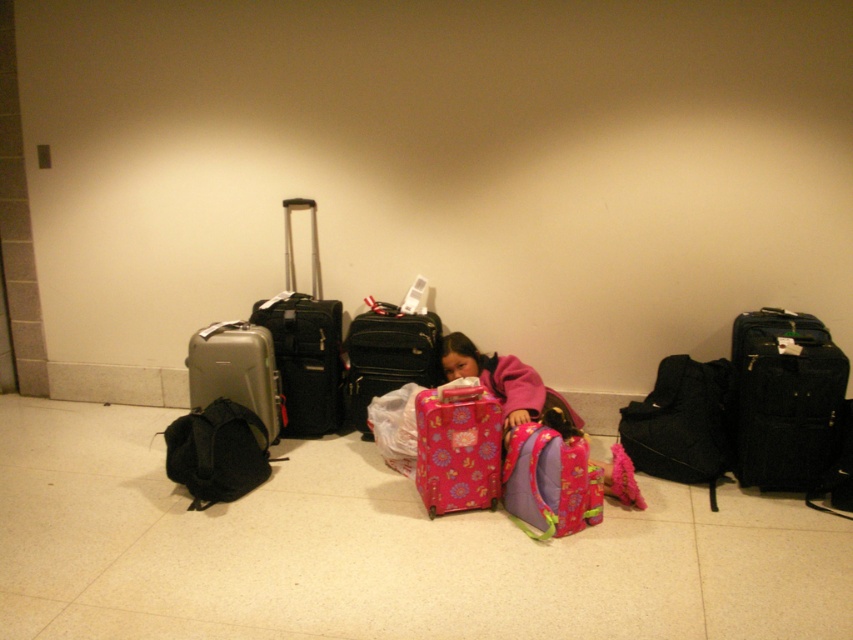
Question: Estimate the real-world distances between objects in this image. Which object is closer to the silver metallic suitcase at left?

Choices:
 (A) black fabric suitcase at right
 (B) black fabric backpack at left

Answer: (B)

Question: Can you confirm if black fabric suitcase at right is wider than pink floral suitcase at center?

Choices:
 (A) yes
 (B) no

Answer: (B)

Question: Among these points, which one is farthest from the camera?

Choices:
 (A) (386, 376)
 (B) (508, 460)
 (C) (323, 429)

Answer: (C)

Question: Estimate the real-world distances between objects in this image. Which object is closer to the black fabric backpack at left?

Choices:
 (A) pink floral suitcase at center
 (B) matte black suitcase at center
 (C) silver metallic suitcase at left

Answer: (C)

Question: Is silver metallic suitcase at left bigger than metallic hardshell suitcase at left?

Choices:
 (A) no
 (B) yes

Answer: (B)

Question: Is black fabric suitcase at right to the left of pink floral backpack at center from the viewer's perspective?

Choices:
 (A) no
 (B) yes

Answer: (A)